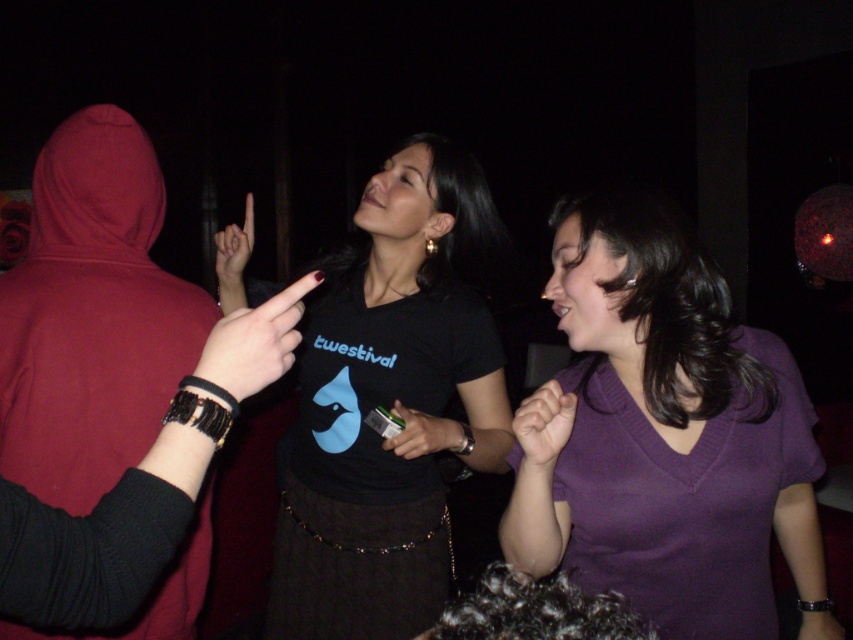
Is smooth skin hand at center behind matte plastic hand at center?

No, it is in front of matte plastic hand at center.

Which is behind, point (515, 426) or point (395, 408)?

The point (395, 408) is more distant.

Identify the location of smooth skin hand at center. This screenshot has width=853, height=640. (543, 428).

Image resolution: width=853 pixels, height=640 pixels. I want to click on smooth skin hand at center, so click(x=543, y=428).

Is smooth skin hand at center to the left of matte black finger at upper center from the viewer's perspective?

Incorrect, smooth skin hand at center is not on the left side of matte black finger at upper center.

The image size is (853, 640). What do you see at coordinates (543, 428) in the screenshot?
I see `smooth skin hand at center` at bounding box center [543, 428].

At what (x,y) coordinates should I click in order to perform the action: click on smooth skin hand at center. Please return your answer as a coordinate pair (x, y). The image size is (853, 640). Looking at the image, I should click on (543, 428).

What are the coordinates of `purple matte shirt at center` in the screenshot? It's located at (670, 435).

Describe the element at coordinates (670, 435) in the screenshot. I see `purple matte shirt at center` at that location.

Where is `purple matte shirt at center`? Image resolution: width=853 pixels, height=640 pixels. purple matte shirt at center is located at coordinates (670, 435).